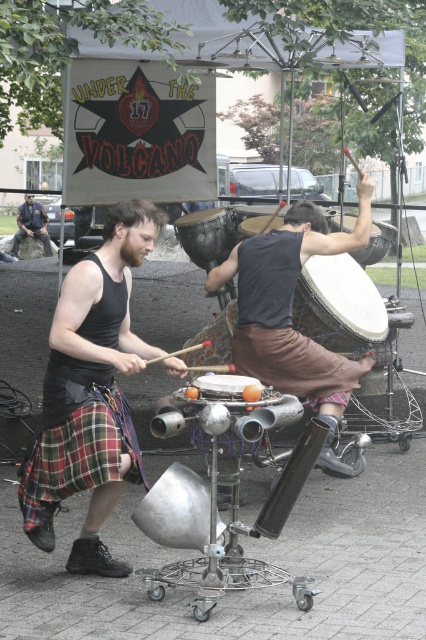
You are a photographer trying to capture the best angle for the drumming performance. You notice two points of interest marked as point (111, 241) and point (212, 394). Which point is closer to your camera position?

Point (111, 241) is closer to the camera position because it is further to the viewer than point (212, 394).

Where is the matte silver drum at center located in terms of coordinates?

The matte silver drum at center is located at coordinates point (x=224, y=385).